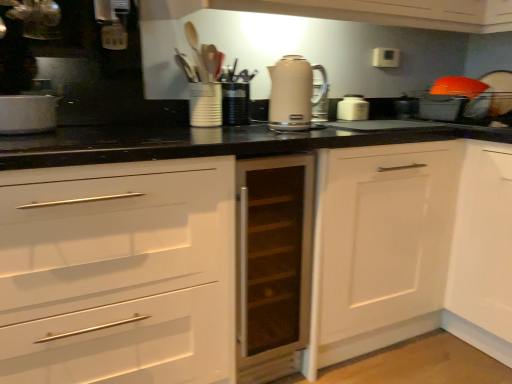
Find the location of a particular element. Image resolution: width=512 pixels, height=384 pixels. free space in front of white glossy toaster at center, which is the 3th kitchen appliance from left to right is located at coordinates [x=355, y=118].